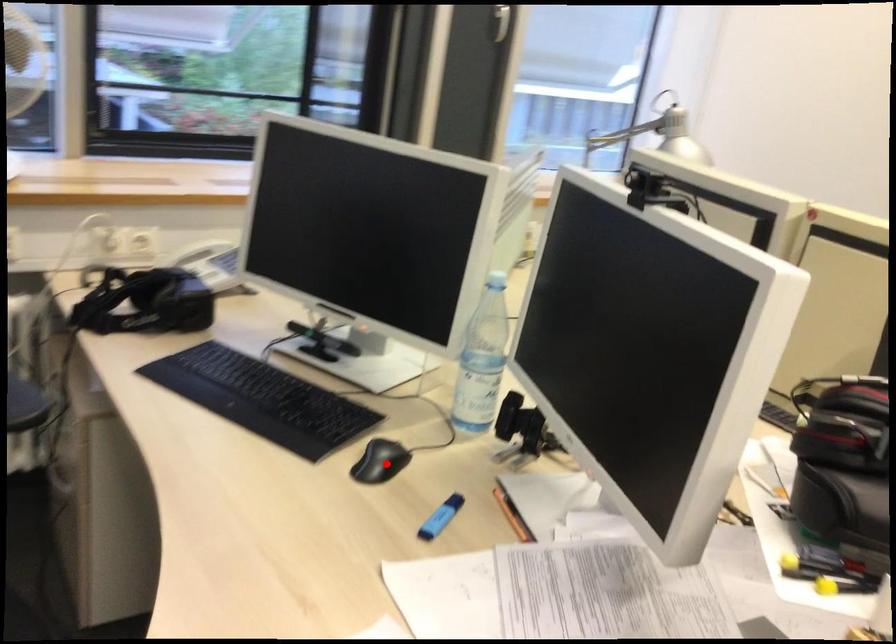
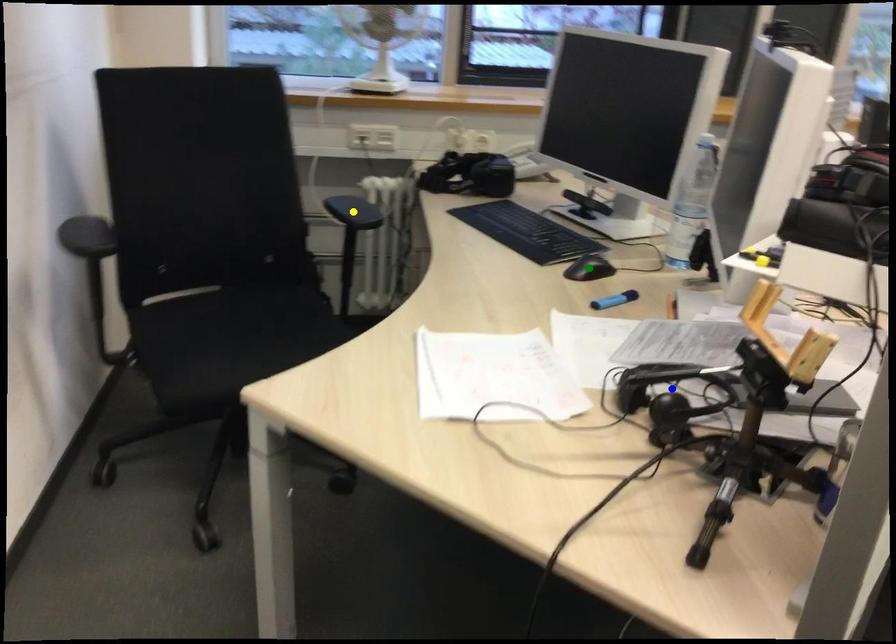
Question: I am providing you with two images of the same scene from different viewpoints. A red point is marked on the first image. You are given multiple points on the second image. Can you choose the point in image 2 that corresponds to the point in image 1?

Choices:
 (A) green point
 (B) blue point
 (C) yellow point

Answer: (A)